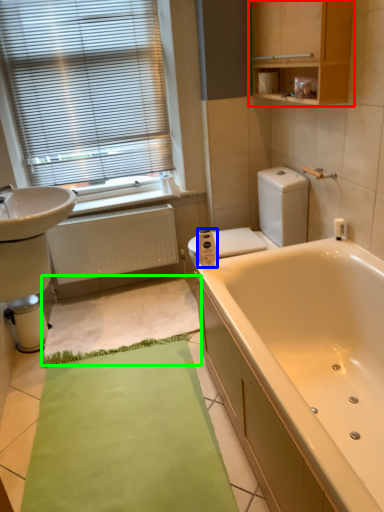
Question: Which object is positioned farthest from medicine cabinet (highlighted by a red box)? Select from toilet paper (highlighted by a blue box) and bath mat (highlighted by a green box).

Choices:
 (A) toilet paper
 (B) bath mat

Answer: (B)